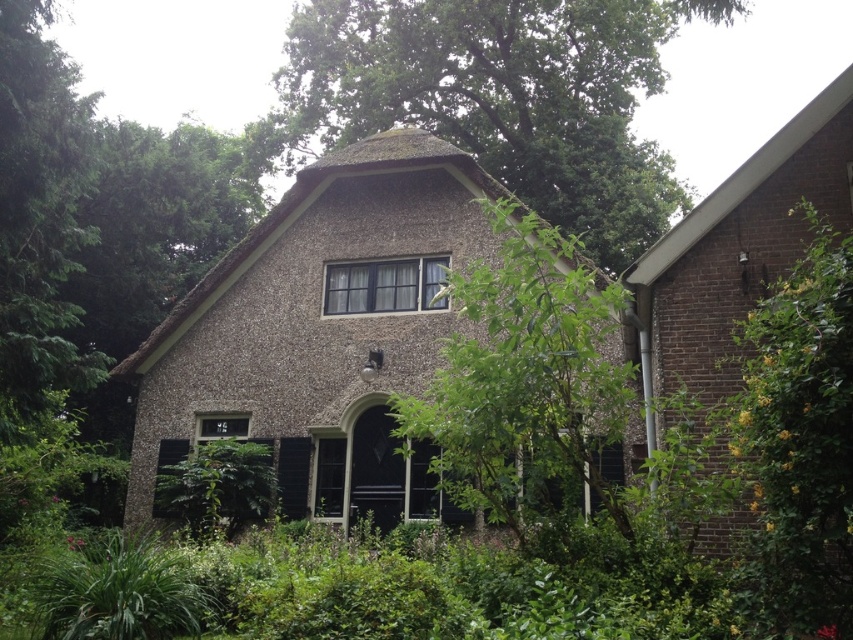
You are standing at the entrance of the house and want to take a photo of the point at coordinates point (631, 0). If your camera has a focal length of 50mm and you want the point to be in focus, what distance should you set your camera to focus at?

The point at coordinates point (631, 0) is 21.19 meters from the camera, so you should set your camera to focus at 21.19 meters to ensure the point is in focus.

You are standing in front of the traditional house and notice two green leafy trees. One is labeled as the green leafy tree at upper center and the other as the green leafy tree at center. Which tree is nearer to you?

The green leafy tree at upper center is closer to the viewer than the green leafy tree at center.